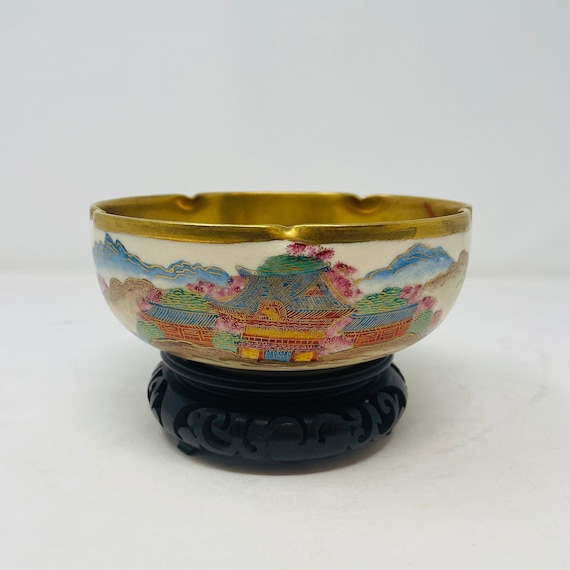
You are a GUI agent. You are given a task and a screenshot of the screen. Output one action in this format:
    pyautogui.click(x=<x>, y=<y>)
    Task: Click on the gold rim of bowl
    
    Given the screenshot: What is the action you would take?
    pyautogui.click(x=123, y=226), pyautogui.click(x=248, y=233), pyautogui.click(x=360, y=233), pyautogui.click(x=429, y=228), pyautogui.click(x=409, y=205), pyautogui.click(x=298, y=197), pyautogui.click(x=226, y=194), pyautogui.click(x=146, y=200)